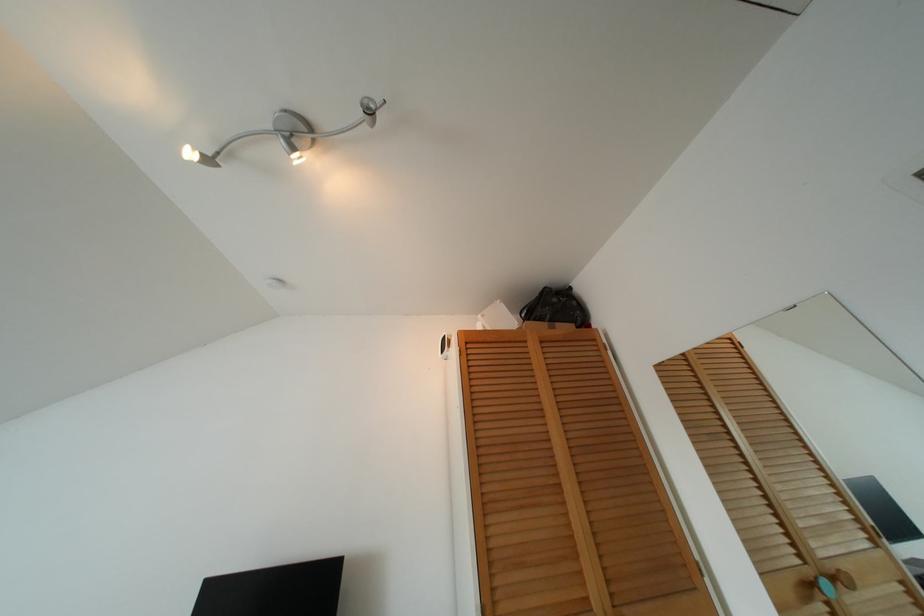
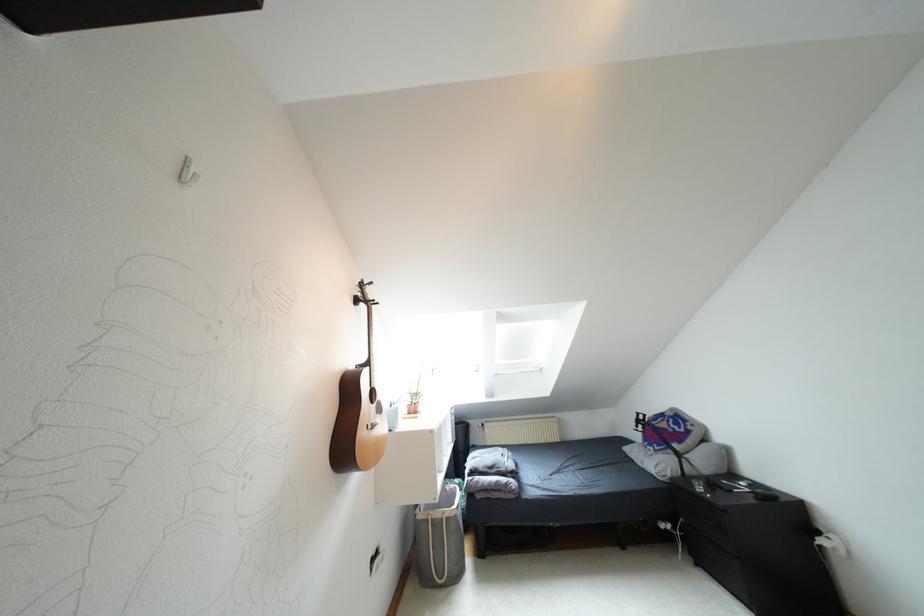
Question: The images are taken continuously from a first-person perspective. In which direction is your viewpoint rotating?

Choices:
 (A) Left
 (B) Right
 (C) Up
 (D) Down

Answer: (A)